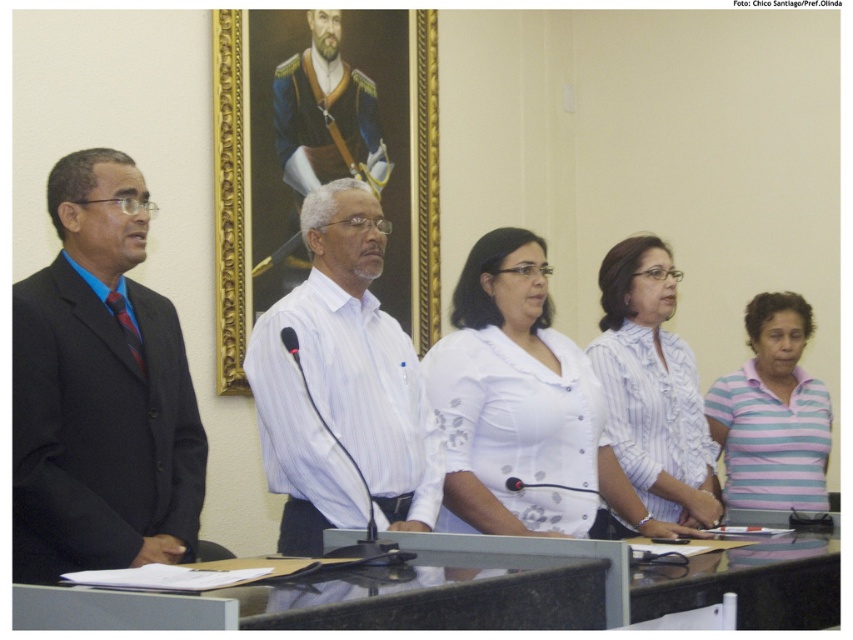
The image size is (853, 640). What do you see at coordinates (321, 156) in the screenshot? I see `gold framed portrait at center` at bounding box center [321, 156].

Which is more to the right, gold framed portrait at center or white striped shirt at center?

From the viewer's perspective, white striped shirt at center appears more on the right side.

This screenshot has height=640, width=853. Describe the element at coordinates (321, 156) in the screenshot. I see `gold framed portrait at center` at that location.

You are a GUI agent. You are given a task and a screenshot of the screen. Output one action in this format:
    pyautogui.click(x=<x>, y=<y>)
    Task: Click on the gold framed portrait at center
    The height and width of the screenshot is (640, 853).
    Given the screenshot: What is the action you would take?
    pyautogui.click(x=321, y=156)

Where is `matte black suit at left`? matte black suit at left is located at coordinates (100, 390).

This screenshot has height=640, width=853. In order to click on matte black suit at left in this screenshot , I will do `click(100, 390)`.

Where is `matte black suit at left`? The width and height of the screenshot is (853, 640). matte black suit at left is located at coordinates (100, 390).

Can you confirm if gold framed portrait at center is positioned to the right of striped cotton shirt at lower right?

In fact, gold framed portrait at center is to the left of striped cotton shirt at lower right.

Can you confirm if gold framed portrait at center is taller than striped cotton shirt at lower right?

Yes, gold framed portrait at center is taller than striped cotton shirt at lower right.

Where is `gold framed portrait at center`? This screenshot has width=853, height=640. gold framed portrait at center is located at coordinates (321, 156).

This screenshot has height=640, width=853. I want to click on gold framed portrait at center, so click(x=321, y=156).